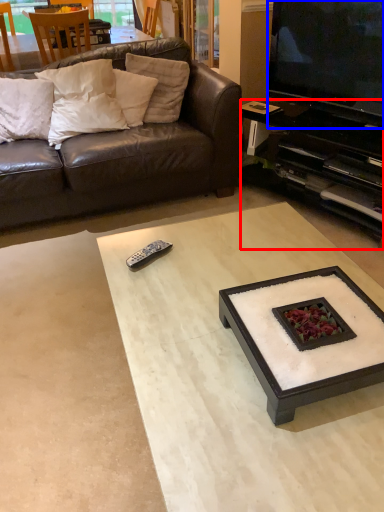
Question: Which object appears closest to the camera in this image, cabinetry (highlighted by a red box) or television (highlighted by a blue box)?

Choices:
 (A) cabinetry
 (B) television

Answer: (B)